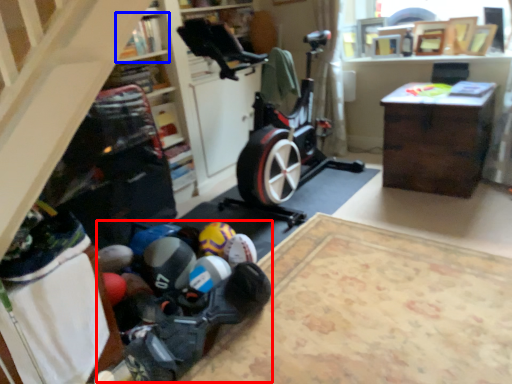
Question: Which object is further to the camera taking this photo, toy (highlighted by a red box) or shelf (highlighted by a blue box)?

Choices:
 (A) toy
 (B) shelf

Answer: (B)